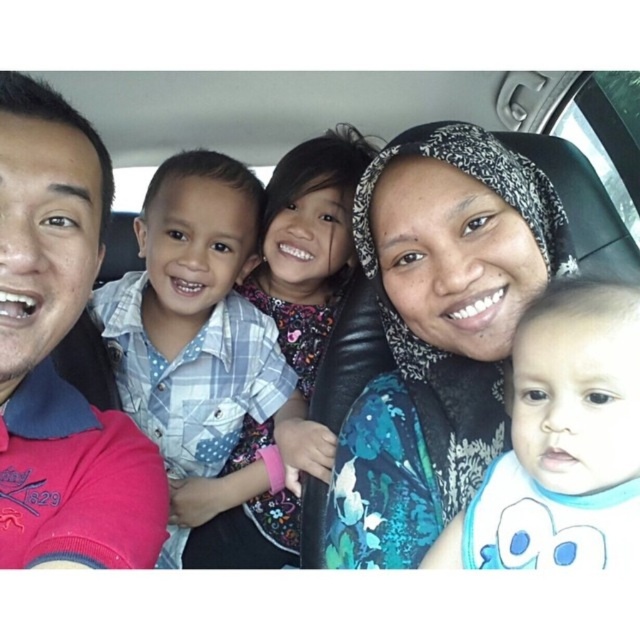
Question: Is floral-patterned headscarf at center above pink fabric shirt at left?

Choices:
 (A) yes
 (B) no

Answer: (B)

Question: Which point is closer to the camera?

Choices:
 (A) (362, 156)
 (B) (90, 204)

Answer: (B)

Question: In this image, where is floral-patterned headscarf at center located relative to pink fabric shirt at left?

Choices:
 (A) below
 (B) above

Answer: (A)

Question: Estimate the real-world distances between objects in this image. Which object is closer to the plaid shirt at left?

Choices:
 (A) pink fabric shirt at left
 (B) floral-patterned headscarf at center
 (C) plaid fabric shirt at center

Answer: (C)

Question: Which object is farther from the camera taking this photo?

Choices:
 (A) pink fabric shirt at left
 (B) white soft bib at lower right

Answer: (A)

Question: Is the position of floral-patterned headscarf at center more distant than that of white soft bib at lower right?

Choices:
 (A) yes
 (B) no

Answer: (A)